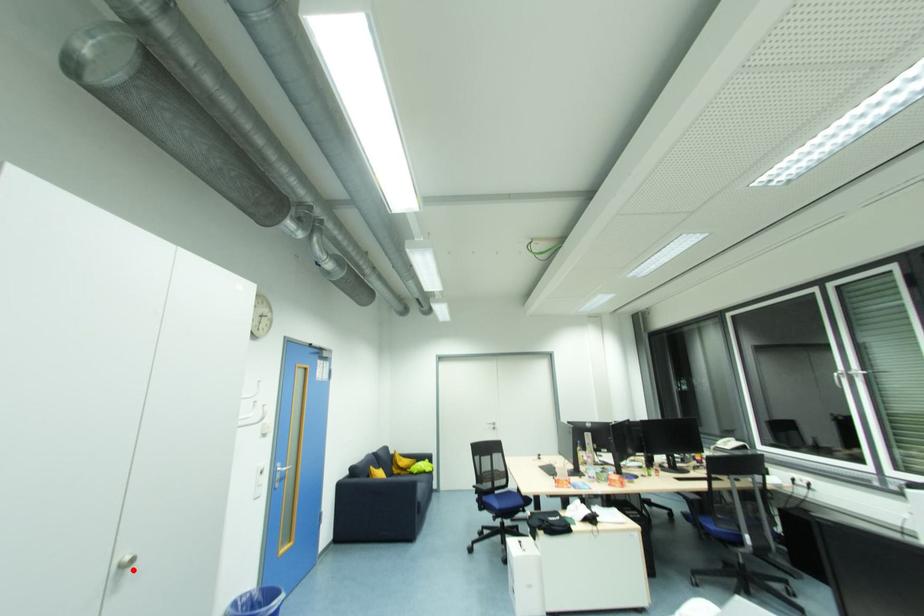
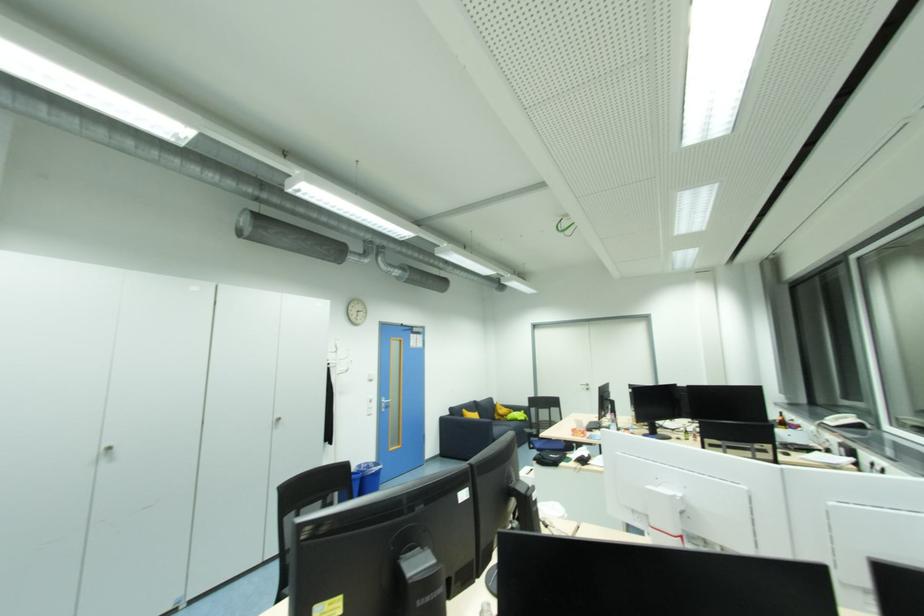
Question: I am providing you with two images of the same scene from different viewpoints. A red point is marked on the first image. Is the red point's position out of view in image 2?

Choices:
 (A) Yes
 (B) No

Answer: (B)